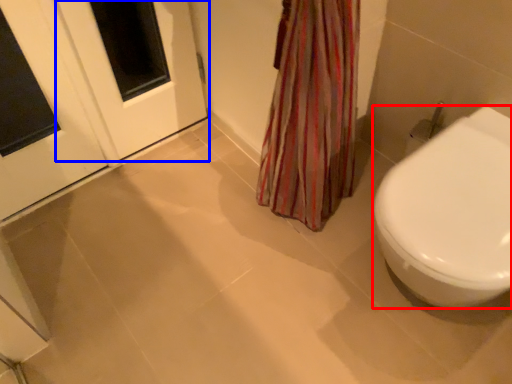
Question: Which object appears farthest to the camera in this image, bidet (highlighted by a red box) or screen door (highlighted by a blue box)?

Choices:
 (A) bidet
 (B) screen door

Answer: (B)